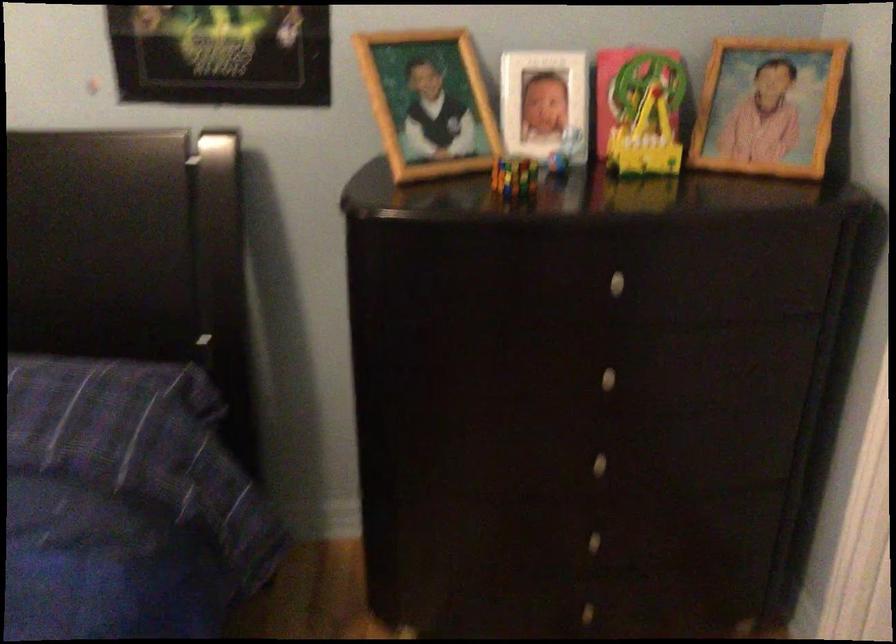
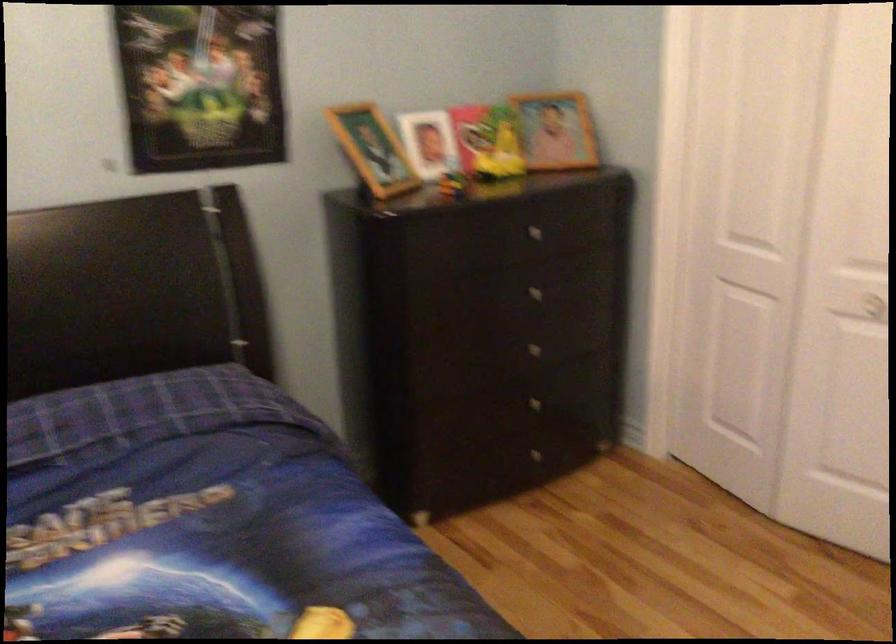
The point at (625, 122) is marked in the first image. Where is the corresponding point in the second image?

(487, 142)